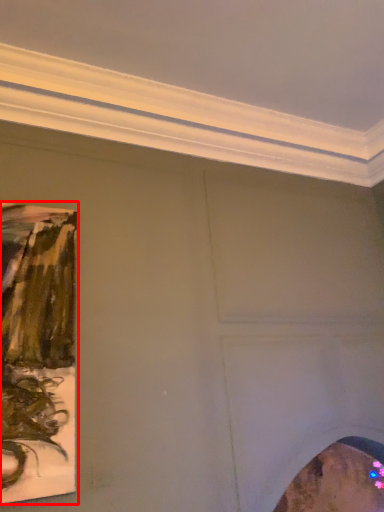
Question: From the image's perspective, where is picture frame (annotated by the red box) located in relation to picture frame in the image?

Choices:
 (A) above
 (B) below

Answer: (A)